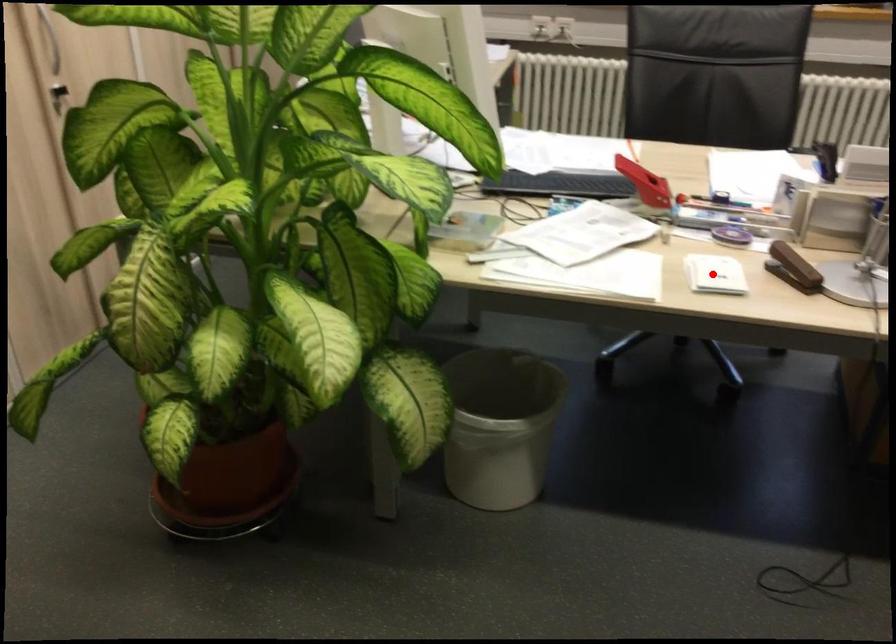
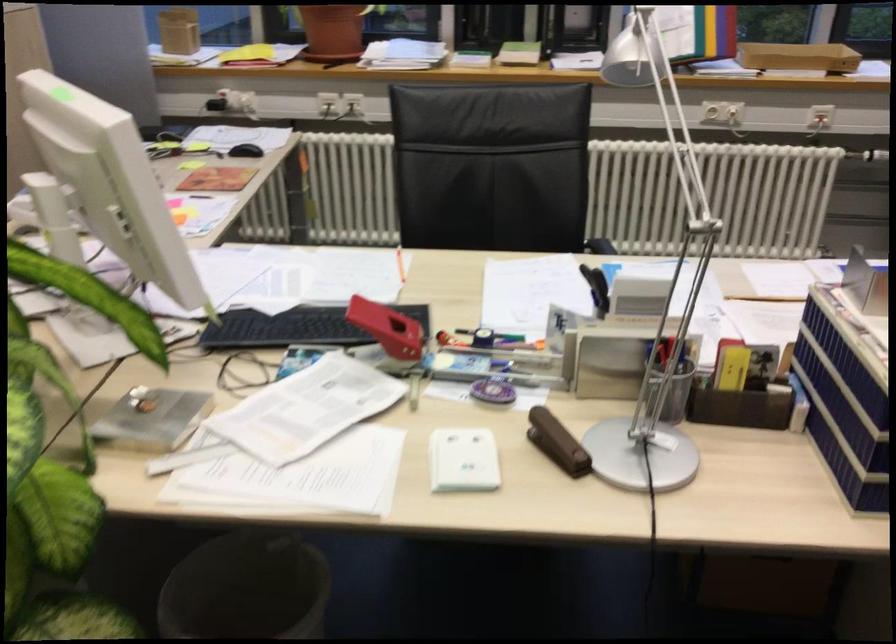
Question: I am providing you with two images of the same scene from different viewpoints. In image1, a red point is highlighted. Considering the same 3D point in image2, which of the following is correct?

Choices:
 (A) It is closer
 (B) It is farther

Answer: (A)